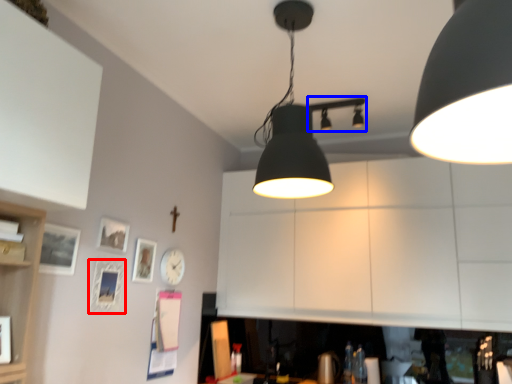
Question: Among these objects, which one is nearest to the camera, picture frame (highlighted by a red box) or lamp (highlighted by a blue box)?

Choices:
 (A) picture frame
 (B) lamp

Answer: (A)